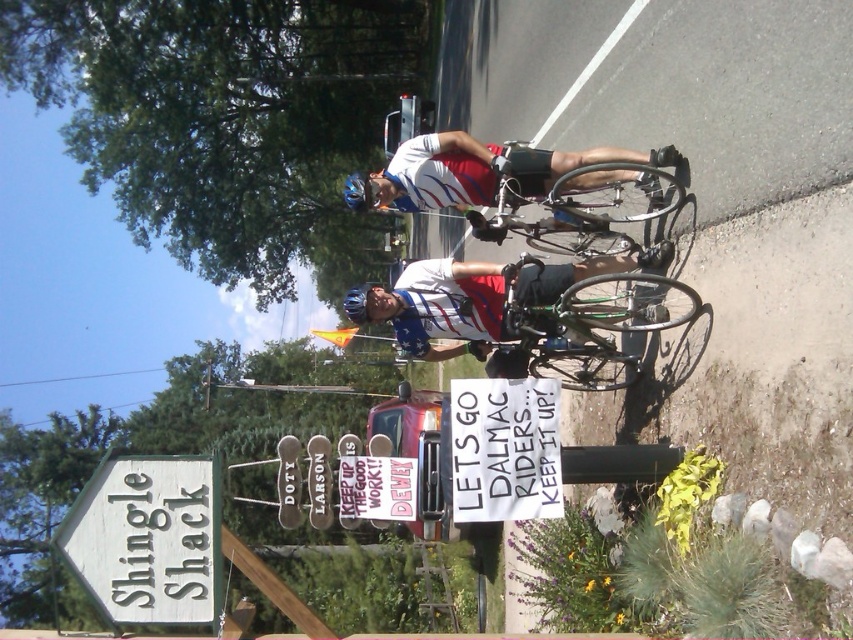
You are a photographer who wants to capture a photo of the matte white and blue cycling jersey at center and the blue matte bicycle helmet at center. Which object should you focus on first if you want to include both in your frame without moving the camera?

The matte white and blue cycling jersey at center is positioned on the right side of blue matte bicycle helmet at center, so you should focus on the blue matte bicycle helmet at center first to ensure both objects are in frame.

You are a photographer trying to capture a photo of the shiny metallic bicycle at center and the matte white and blue cycling jersey at center. From the photographer perspective, which object should you adjust your camera to focus on first if you want to include both in the frame?

The shiny metallic bicycle at center is to the right of the matte white and blue cycling jersey at center, so you should focus on the matte white and blue cycling jersey at center first to ensure both are in the frame.

You are a cyclist who wants to read the white paper sign at center and check the matte blue helmet at center. Which object is shorter?

The white paper sign at center has a lesser height compared to the matte blue helmet at center, so the white paper sign at center is shorter.